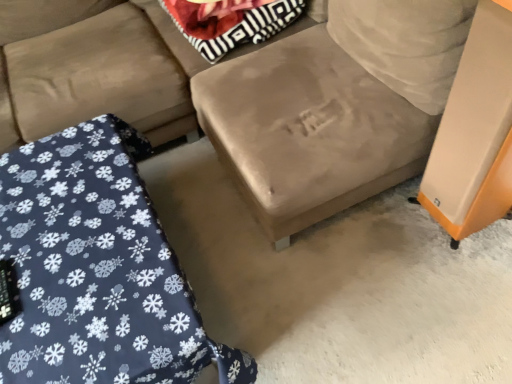
In order to face striped fabric pillow at upper center, should I rotate leftwards or rightwards?

Turn left approximately 4.238 degrees to face it.

What do you see at coordinates (231, 24) in the screenshot? I see `striped fabric pillow at upper center` at bounding box center [231, 24].

Locate an element on the screen. The height and width of the screenshot is (384, 512). blue fabric wrapping at lower left is located at coordinates (97, 269).

Measure the distance from blue fabric wrapping at lower left to velvet blue blanket at lower left.

A distance of 19.01 inches exists between blue fabric wrapping at lower left and velvet blue blanket at lower left.

Which is in front, point (114, 260) or point (190, 129)?

The point (114, 260) is closer.

Is blue fabric wrapping at lower left positioned beyond the bounds of velvet blue blanket at lower left?

blue fabric wrapping at lower left is positioned outside velvet blue blanket at lower left.

Is blue fabric wrapping at lower left facing away from velvet blue blanket at lower left?

That's right, blue fabric wrapping at lower left is facing away from velvet blue blanket at lower left.

From a real-world perspective, is striped fabric pillow at upper center below orange matte speaker at right?

Incorrect, from a real-world perspective, striped fabric pillow at upper center is higher than orange matte speaker at right.

Locate an element on the screen. The width and height of the screenshot is (512, 384). table lying in front of the striped fabric pillow at upper center is located at coordinates (475, 131).

Between striped fabric pillow at upper center and orange matte speaker at right, which one has smaller size?

Smaller between the two is orange matte speaker at right.

Which object is positioned more to the right, striped fabric pillow at upper center or orange matte speaker at right?

orange matte speaker at right.

Is velvet blue blanket at lower left oriented towards suede-like beige couch at center?

No, velvet blue blanket at lower left is not turned towards suede-like beige couch at center.

Considering the relative sizes of velvet blue blanket at lower left and suede-like beige couch at center in the image provided, is velvet blue blanket at lower left thinner than suede-like beige couch at center?

Yes, velvet blue blanket at lower left is thinner than suede-like beige couch at center.

Which of these two, velvet blue blanket at lower left or suede-like beige couch at center, stands taller?

With more height is suede-like beige couch at center.

Between striped fabric pillow at upper center and velvet blue blanket at lower left, which one has larger size?

velvet blue blanket at lower left.

In terms of width, does striped fabric pillow at upper center look wider or thinner when compared to velvet blue blanket at lower left?

Considering their sizes, striped fabric pillow at upper center looks slimmer than velvet blue blanket at lower left.

Which object is further away from the camera, striped fabric pillow at upper center or velvet blue blanket at lower left?

Positioned behind is striped fabric pillow at upper center.

From the image's perspective, is striped fabric pillow at upper center positioned above or below velvet blue blanket at lower left?

Clearly, from the image's perspective, striped fabric pillow at upper center is above velvet blue blanket at lower left.

Find the location of a particular element. The image size is (512, 384). table in front of the suede-like beige couch at center is located at coordinates (475, 131).

Considering the positions of objects suede-like beige couch at center and orange matte speaker at right in the image provided, who is behind, suede-like beige couch at center or orange matte speaker at right?

suede-like beige couch at center is further from the camera.

Between suede-like beige couch at center and orange matte speaker at right, which one has larger size?

suede-like beige couch at center is bigger.

Is suede-like beige couch at center far away from orange matte speaker at right?

Actually, suede-like beige couch at center and orange matte speaker at right are a little close together.

From a real-world perspective, which object rests below the other?

blue fabric wrapping at lower left.

Locate an element on the screen. This screenshot has width=512, height=384. furniture directly beneath the striped fabric pillow at upper center (from a real-world perspective) is located at coordinates (97, 269).

Can you see striped fabric pillow at upper center touching blue fabric wrapping at lower left?

No, striped fabric pillow at upper center is not with blue fabric wrapping at lower left.

Considering the sizes of objects striped fabric pillow at upper center and blue fabric wrapping at lower left in the image provided, who is wider, striped fabric pillow at upper center or blue fabric wrapping at lower left?

Wider between the two is blue fabric wrapping at lower left.

Visually, is velvet blue blanket at lower left positioned to the left or to the right of striped fabric pillow at upper center?

From the image, it's evident that velvet blue blanket at lower left is to the left of striped fabric pillow at upper center.

Which object is thinner, velvet blue blanket at lower left or striped fabric pillow at upper center?

striped fabric pillow at upper center.

From the image's perspective, between velvet blue blanket at lower left and striped fabric pillow at upper center, who is located below?

velvet blue blanket at lower left is shown below in the image.

This screenshot has height=384, width=512. In the image, there is a velvet blue blanket at lower left. Find the location of `pillow above it (from the image's perspective)`. pillow above it (from the image's perspective) is located at coordinates (231, 24).

I want to click on furniture below the velvet blue blanket at lower left (from the image's perspective), so pyautogui.click(x=97, y=269).

The width and height of the screenshot is (512, 384). I want to click on pillow positioned vertically above the orange matte speaker at right (from a real-world perspective), so click(x=231, y=24).

Looking at the image, which one is located further to velvet blue blanket at lower left, blue fabric wrapping at lower left or suede-like beige couch at center?

The object further to velvet blue blanket at lower left is blue fabric wrapping at lower left.

Looking at the image, which one is located closer to orange matte speaker at right, velvet blue blanket at lower left or blue fabric wrapping at lower left?

The object closer to orange matte speaker at right is blue fabric wrapping at lower left.

Considering their positions, is velvet blue blanket at lower left positioned closer to suede-like beige couch at center than striped fabric pillow at upper center?

velvet blue blanket at lower left is positioned closer to the anchor suede-like beige couch at center.

When comparing their distances from suede-like beige couch at center, does striped fabric pillow at upper center or orange matte speaker at right seem further?

Based on the image, orange matte speaker at right appears to be further to suede-like beige couch at center.

Based on their spatial positions, is blue fabric wrapping at lower left or striped fabric pillow at upper center closer to suede-like beige couch at center?

striped fabric pillow at upper center lies closer to suede-like beige couch at center than the other object.

Looking at this image, estimate the real-world distances between objects in this image. Which object is further from striped fabric pillow at upper center, blue fabric wrapping at lower left or suede-like beige couch at center?

blue fabric wrapping at lower left is further to striped fabric pillow at upper center.

Based on their spatial positions, is orange matte speaker at right or suede-like beige couch at center further from velvet blue blanket at lower left?

orange matte speaker at right.

From the image, which object appears to be nearer to orange matte speaker at right, blue fabric wrapping at lower left or velvet blue blanket at lower left?

blue fabric wrapping at lower left is closer to orange matte speaker at right.

Locate an element on the screen. couch between striped fabric pillow at upper center and blue fabric wrapping at lower left in the up-down direction is located at coordinates (94, 79).

Find the location of a particular element. The width and height of the screenshot is (512, 384). furniture situated between velvet blue blanket at lower left and orange matte speaker at right from left to right is located at coordinates (97, 269).

At what (x,y) coordinates should I click in order to perform the action: click on studio couch situated between blue fabric wrapping at lower left and orange matte speaker at right from left to right. Please return your answer as a coordinate pair (x, y). Looking at the image, I should click on (249, 94).

At what (x,y) coordinates should I click in order to perform the action: click on studio couch between velvet blue blanket at lower left and orange matte speaker at right in the horizontal direction. Please return your answer as a coordinate pair (x, y). The width and height of the screenshot is (512, 384). Looking at the image, I should click on (249, 94).